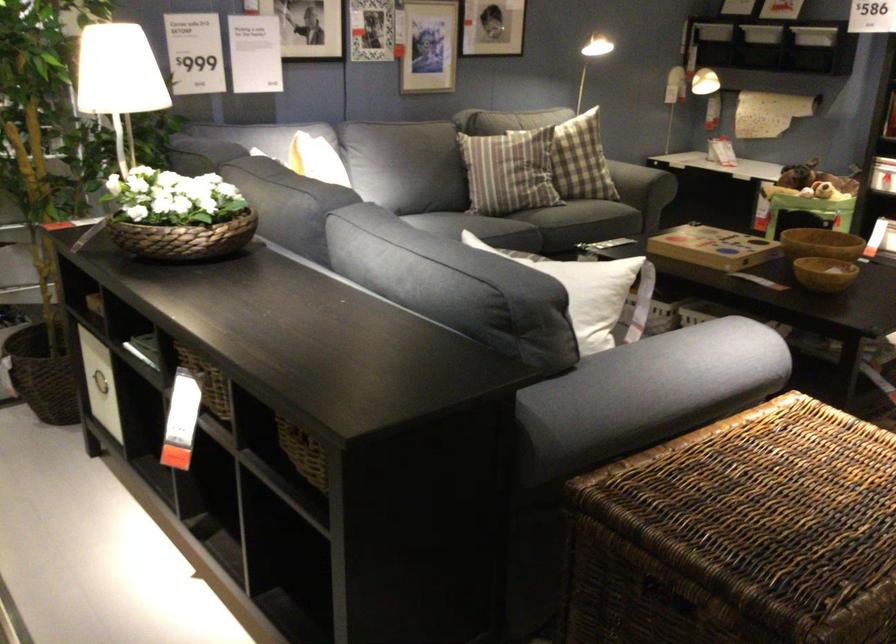
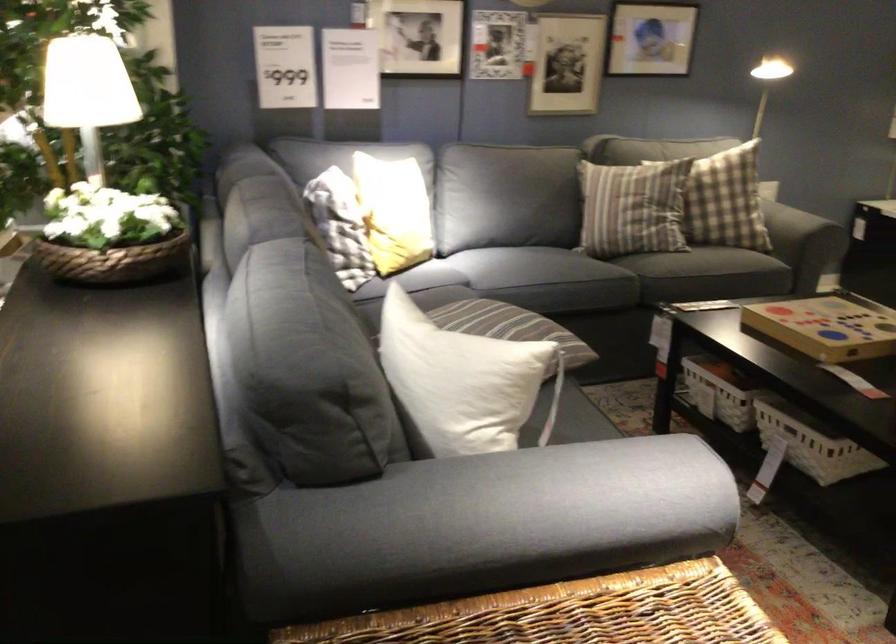
Find the pixel in the second image that matches point (737, 250) in the first image.

(828, 326)